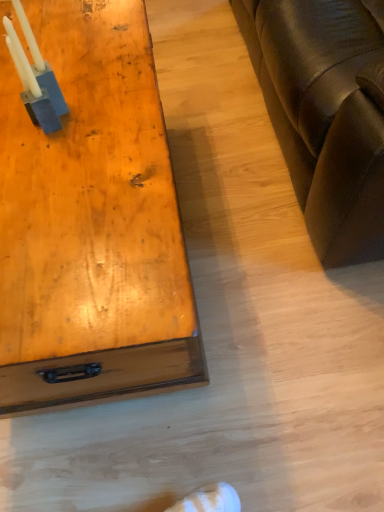
The image size is (384, 512). What do you see at coordinates (324, 116) in the screenshot?
I see `brown leather couch at right` at bounding box center [324, 116].

Image resolution: width=384 pixels, height=512 pixels. In order to click on brown leather couch at right in this screenshot , I will do `click(324, 116)`.

Measure the distance between point (25,323) and camera.

Point (25,323) and camera are 65.10 centimeters apart.

What do you see at coordinates (91, 223) in the screenshot? I see `wooden table at left` at bounding box center [91, 223].

The width and height of the screenshot is (384, 512). Identify the location of wooden table at left. (91, 223).

Consider the image. In order to face wooden table at left, should I rotate leftwards or rightwards?

Rotate left and turn 15.659 degrees.

Where is `brown leather couch at right`? Image resolution: width=384 pixels, height=512 pixels. brown leather couch at right is located at coordinates (324, 116).

Which object is positioned more to the right, brown leather couch at right or wooden table at left?

brown leather couch at right.

Between brown leather couch at right and wooden table at left, which one is positioned behind?

wooden table at left is behind.

Considering the points (343, 223) and (78, 109), which point is behind, point (343, 223) or point (78, 109)?

The point (343, 223) is farther.

From the image's perspective, is brown leather couch at right positioned above or below wooden table at left?

From the image's perspective, brown leather couch at right appears above wooden table at left.

Based on the photo, from a real-world perspective, is brown leather couch at right above or below wooden table at left?

brown leather couch at right is above wooden table at left.

Which object is thinner, brown leather couch at right or wooden table at left?

With smaller width is wooden table at left.

Who is shorter, brown leather couch at right or wooden table at left?

wooden table at left.

Considering the relative sizes of brown leather couch at right and wooden table at left in the image provided, is brown leather couch at right bigger than wooden table at left?

Indeed, brown leather couch at right has a larger size compared to wooden table at left.

Can we say brown leather couch at right lies outside wooden table at left?

Yes, brown leather couch at right is located beyond the bounds of wooden table at left.

Is brown leather couch at right far away from wooden table at left?

No.

In the scene shown: Is brown leather couch at right oriented towards wooden table at left?

Yes.

Can you tell me how much brown leather couch at right and wooden table at left differ in facing direction?

brown leather couch at right and wooden table at left are facing 0.994 degrees away from each other.

How far apart are brown leather couch at right and wooden table at left?

A distance of 19.64 inches exists between brown leather couch at right and wooden table at left.

Locate an element on the screen. The width and height of the screenshot is (384, 512). studio couch above the wooden table at left (from a real-world perspective) is located at coordinates (324, 116).

Which is more to the left, wooden table at left or brown leather couch at right?

From the viewer's perspective, wooden table at left appears more on the left side.

Is the depth of wooden table at left greater than that of brown leather couch at right?

Yes, wooden table at left is further from the camera.

Which point is more distant from viewer, (x=163, y=262) or (x=284, y=85)?

The point (x=284, y=85) is farther.

From the image's perspective, which one is positioned lower, wooden table at left or brown leather couch at right?

wooden table at left.

From a real-world perspective, which is physically below, wooden table at left or brown leather couch at right?

wooden table at left, from a real-world perspective.

In terms of width, does wooden table at left look wider or thinner when compared to brown leather couch at right?

Clearly, wooden table at left has less width compared to brown leather couch at right.

Does wooden table at left have a lesser height compared to brown leather couch at right?

Yes, wooden table at left is shorter than brown leather couch at right.

Considering the sizes of wooden table at left and brown leather couch at right in the image, is wooden table at left bigger or smaller than brown leather couch at right?

In the image, wooden table at left appears to be smaller than brown leather couch at right.

Is brown leather couch at right inside wooden table at left?

That's incorrect, brown leather couch at right is not inside wooden table at left.

Are wooden table at left and brown leather couch at right beside each other?

wooden table at left and brown leather couch at right are not in contact.

Is wooden table at left turned away from brown leather couch at right?

That's right, wooden table at left is facing away from brown leather couch at right.

Can you tell me how much wooden table at left and brown leather couch at right differ in facing direction?

The angle between the facing direction of wooden table at left and the facing direction of brown leather couch at right is 0.994 degrees.

How distant is wooden table at left from brown leather couch at right?

A distance of 19.64 inches exists between wooden table at left and brown leather couch at right.

The image size is (384, 512). In order to click on studio couch lying in front of the wooden table at left in this screenshot , I will do `click(324, 116)`.

Locate an element on the screen. table located on the left of brown leather couch at right is located at coordinates (91, 223).

Locate an element on the screen. This screenshot has width=384, height=512. table below the brown leather couch at right (from a real-world perspective) is located at coordinates (91, 223).